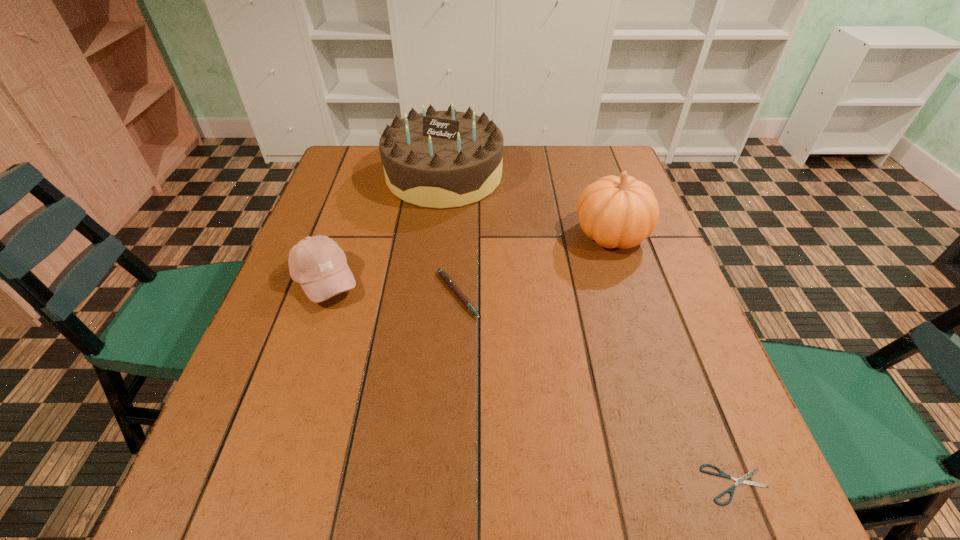
Image resolution: width=960 pixels, height=540 pixels. In order to click on vacant space situated 0.170m on the left of the nearest object in this screenshot , I will do `click(597, 484)`.

Where is `object that is at the far edge`? This screenshot has height=540, width=960. object that is at the far edge is located at coordinates (436, 159).

The width and height of the screenshot is (960, 540). I want to click on object that is at the near edge, so click(x=731, y=490).

Locate an element on the screen. object that is positioned at the left edge is located at coordinates (318, 264).

The height and width of the screenshot is (540, 960). Identify the location of pumpkin that is at the right edge. (621, 212).

Locate an element on the screen. shears present at the right edge is located at coordinates (731, 490).

Where is `object that is at the near right corner`? This screenshot has width=960, height=540. object that is at the near right corner is located at coordinates (731, 490).

Where is `vacant space at the near edge of the desktop`? vacant space at the near edge of the desktop is located at coordinates (580, 514).

This screenshot has height=540, width=960. What are the coordinates of `free space at the right edge of the desktop` in the screenshot? It's located at (660, 352).

At what (x,y) coordinates should I click in order to perform the action: click on free location at the far left corner of the desktop. Please return your answer as a coordinate pair (x, y). This screenshot has height=540, width=960. Looking at the image, I should click on (349, 164).